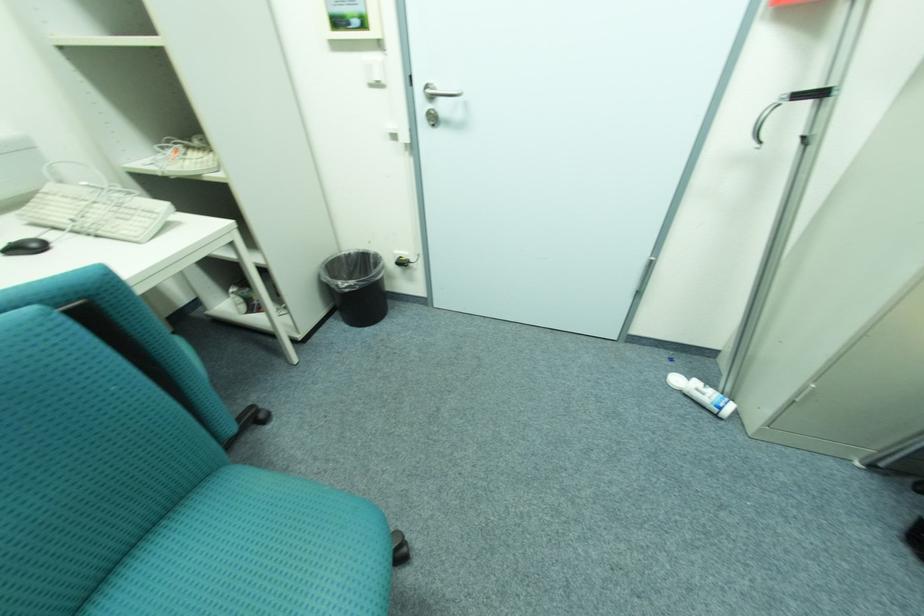
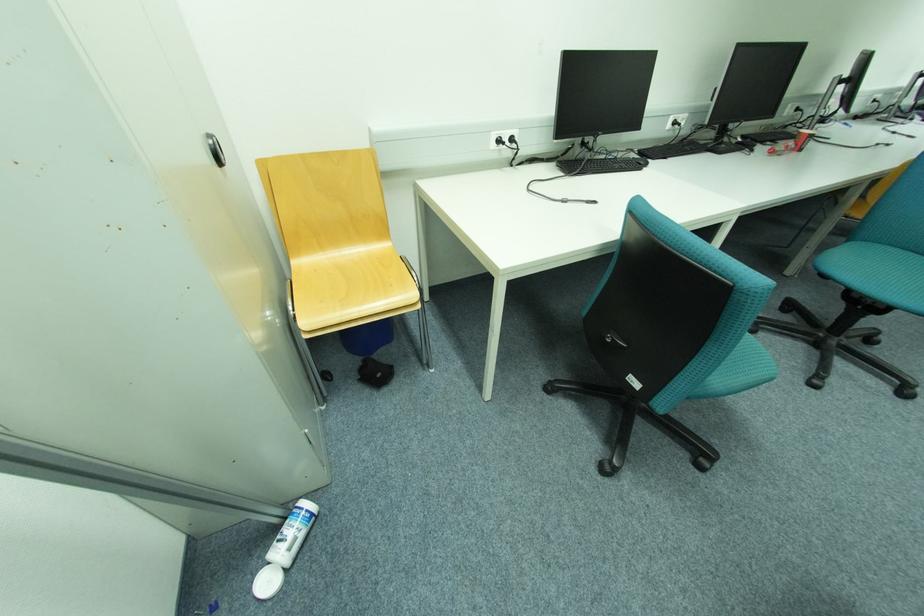
In the second image, find the point that corresponds to point (683, 381) in the first image.

(274, 584)